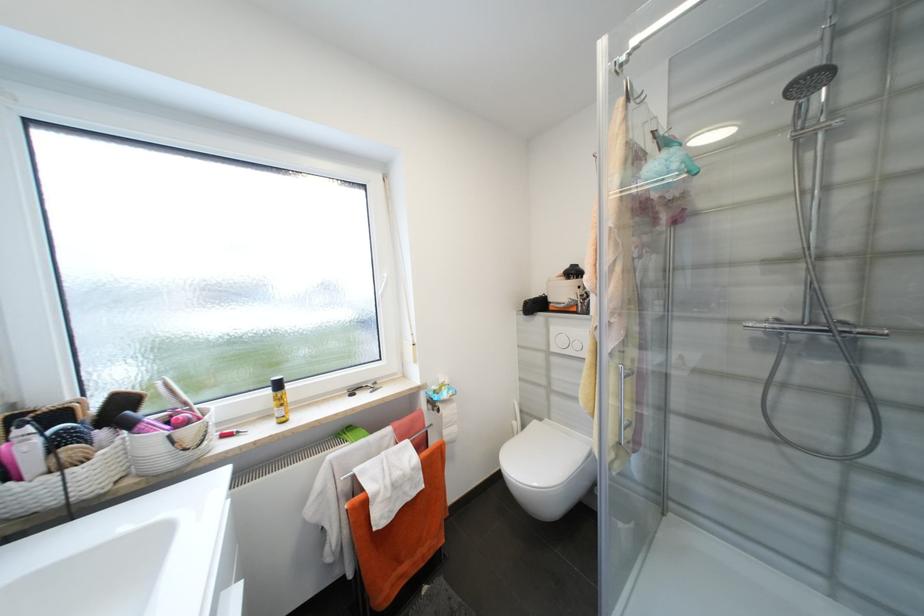
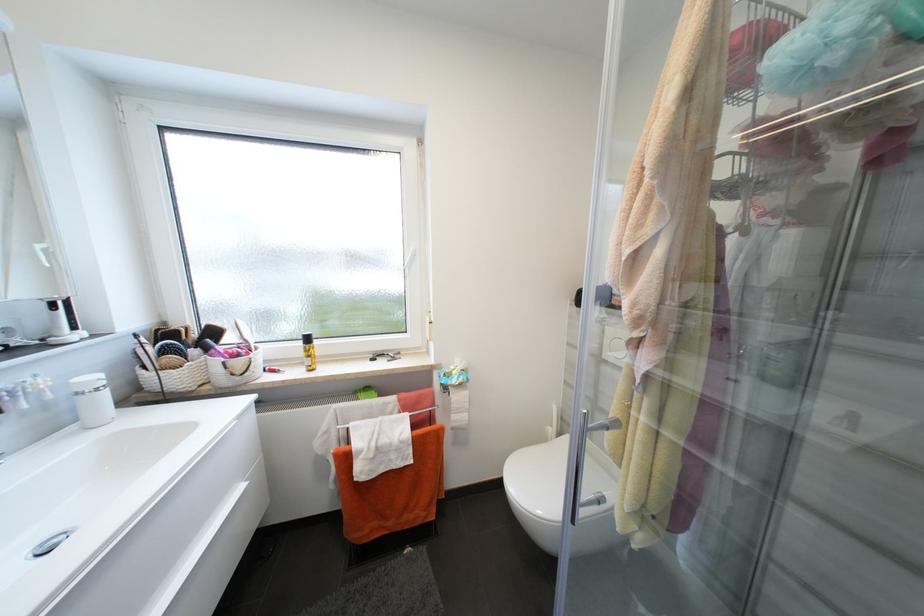
Question: How did the camera likely rotate?

Choices:
 (A) Left
 (B) Right
 (C) Up
 (D) Down

Answer: (A)